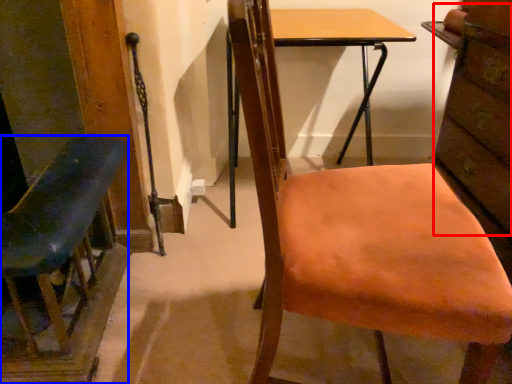
Question: Which of the following is the farthest to the observer, drawer (highlighted by a red box) or chair (highlighted by a blue box)?

Choices:
 (A) drawer
 (B) chair

Answer: (A)